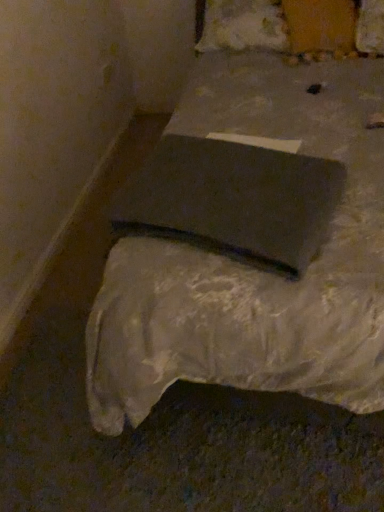
Question: From their relative heights in the image, would you say white cotton pillow at upper center is taller or shorter than matte gray bed at center?

Choices:
 (A) tall
 (B) short

Answer: (B)

Question: Is white cotton pillow at upper center in front of or behind matte gray bed at center in the image?

Choices:
 (A) front
 (B) behind

Answer: (B)

Question: Which object is positioned farthest from the matte gray pad at center?

Choices:
 (A) matte gray bed at center
 (B) white cotton pillow at upper center

Answer: (B)

Question: Which object is the closest to the matte gray bed at center?

Choices:
 (A) matte gray pad at center
 (B) white cotton pillow at upper center

Answer: (A)